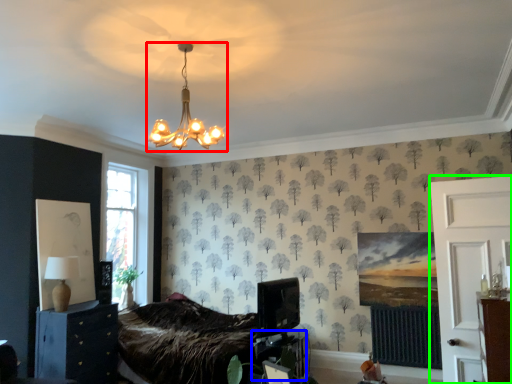
Question: Based on their relative distances, which object is nearer to lamp (highlighted by a red box)? Choose from table (highlighted by a blue box) and side (highlighted by a green box).

Choices:
 (A) table
 (B) side

Answer: (A)